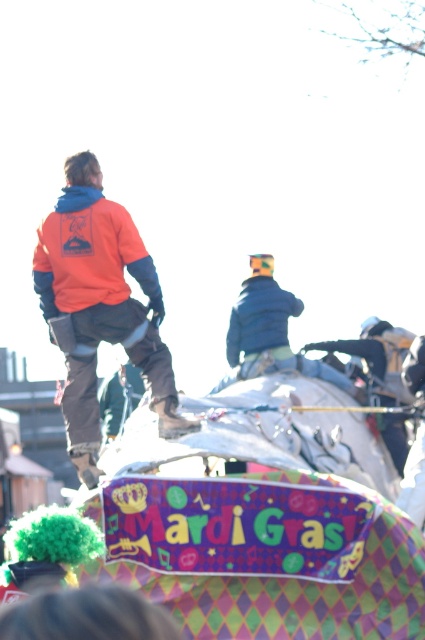
Question: Which object is closer to the camera taking this photo?

Choices:
 (A) orange fleece jacket at upper left
 (B) blue denim jacket at upper center
 (C) blue fuzzy jacket at center

Answer: (A)

Question: Which of the following is the closest to the observer?

Choices:
 (A) (62, 209)
 (B) (237, 362)

Answer: (A)

Question: Is orange fleece jacket at upper left closer to camera compared to blue fuzzy jacket at center?

Choices:
 (A) yes
 (B) no

Answer: (A)

Question: Estimate the real-world distances between objects in this image. Which object is farther from the orange fleece jacket at upper left?

Choices:
 (A) blue fuzzy jacket at center
 (B) blue denim jacket at upper center

Answer: (A)

Question: Does orange fleece jacket at upper left have a smaller size compared to blue denim jacket at upper center?

Choices:
 (A) no
 (B) yes

Answer: (A)

Question: Is orange fleece jacket at upper left closer to camera compared to blue denim jacket at upper center?

Choices:
 (A) yes
 (B) no

Answer: (A)